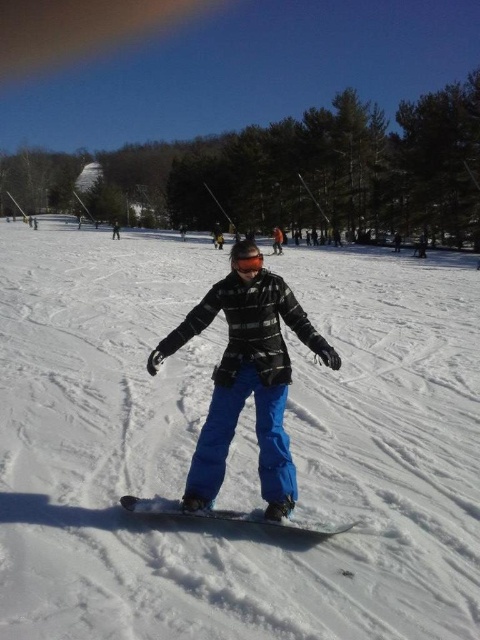
Question: Among these objects, which one is farthest from the camera?

Choices:
 (A) black matte snowboard at center
 (B) white matte snowboard at center

Answer: (A)

Question: Based on their relative distances, which object is farther from the white matte snowboard at center?

Choices:
 (A) black matte goggles at center
 (B) matte black snowboarder at center
 (C) black matte snowboard at center

Answer: (A)

Question: From the image, what is the correct spatial relationship of white matte snowboard at center in relation to black matte snowboard at center?

Choices:
 (A) below
 (B) above

Answer: (B)

Question: Does white matte snowboard at center have a larger size compared to matte black snowboarder at center?

Choices:
 (A) yes
 (B) no

Answer: (A)

Question: Which point appears closest to the camera in this image?

Choices:
 (A) (429, 328)
 (B) (228, 358)
 (C) (254, 256)
 (D) (235, 520)

Answer: (D)

Question: Does white matte snowboard at center appear on the left side of black matte snowboard at center?

Choices:
 (A) yes
 (B) no

Answer: (A)